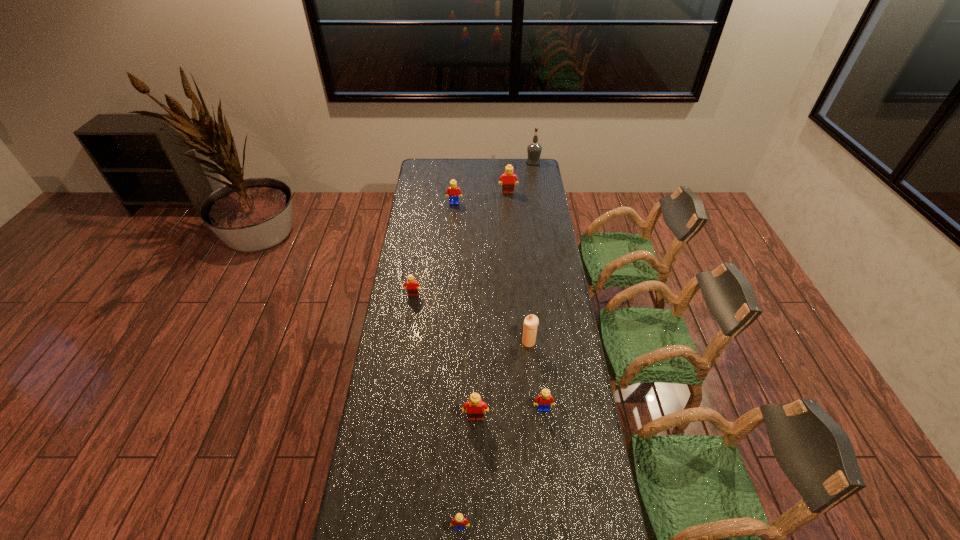
I want to click on the leftmost Lego, so click(x=412, y=289).

Locate an element on the screen. the second biggest yellow Lego is located at coordinates (542, 401).

This screenshot has height=540, width=960. Find the location of `the rightmost yellow Lego`. the rightmost yellow Lego is located at coordinates (542, 401).

Locate an element on the screen. The width and height of the screenshot is (960, 540). the nearest yellow Lego is located at coordinates (458, 522).

The height and width of the screenshot is (540, 960). Identify the location of the shortest Lego. (458, 522).

Where is `vacant space located 0.130m on the front label of the vodka`? This screenshot has height=540, width=960. vacant space located 0.130m on the front label of the vodka is located at coordinates (505, 163).

I want to click on free space located on the front label of the vodka, so click(x=478, y=163).

Identify the location of vacant space situated on the front label of the vodka. The image size is (960, 540). click(518, 163).

At what (x,y) coordinates should I click in order to perform the action: click on free space located on the face of the second farthest object. Please return your answer as a coordinate pair (x, y). Image resolution: width=960 pixels, height=540 pixels. Looking at the image, I should click on (509, 205).

Where is `free point located on the front of the fourth nearest object`? Image resolution: width=960 pixels, height=540 pixels. free point located on the front of the fourth nearest object is located at coordinates (538, 432).